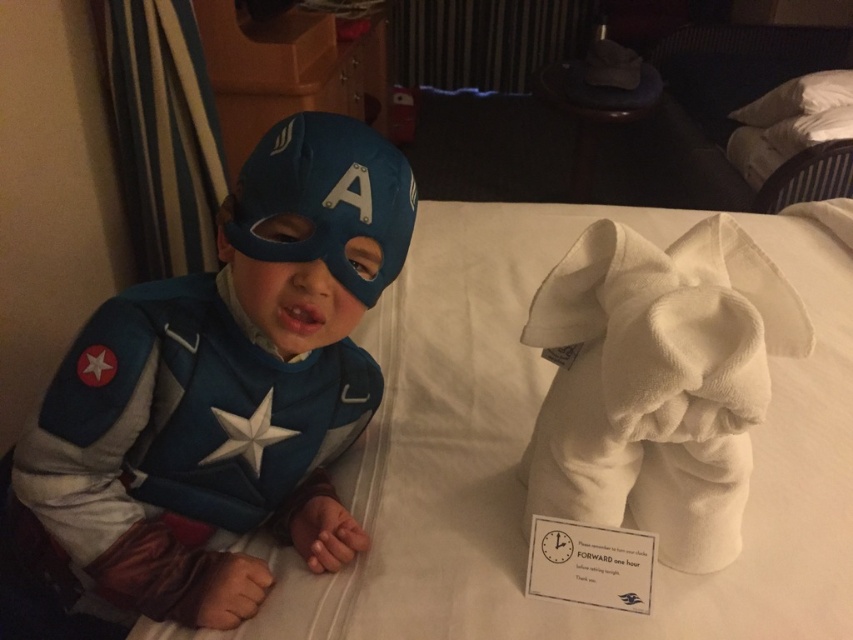
Between point (68, 380) and point (750, 124), which one is positioned in front?

Point (68, 380) is more forward.

Which of these two, blue fabric costume at left or white soft pillow at upper right, stands taller?

blue fabric costume at left is taller.

Is point (126, 604) more distant than point (766, 97)?

No, (126, 604) is closer to viewer.

You are a GUI agent. You are given a task and a screenshot of the screen. Output one action in this format:
    pyautogui.click(x=<x>, y=<y>)
    Task: Click on the blue fabric costume at left
    The height and width of the screenshot is (640, 853).
    Given the screenshot: What is the action you would take?
    [x=218, y=397]